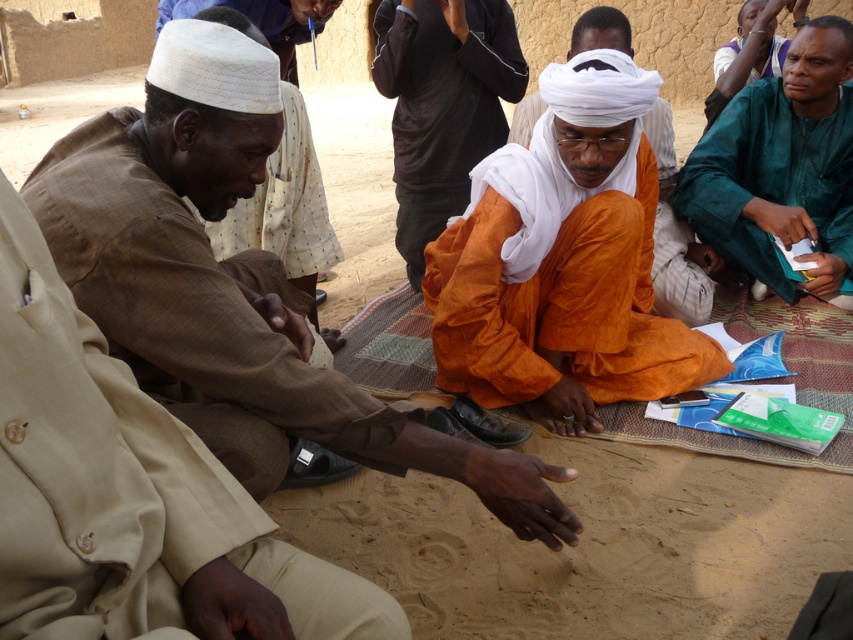
You are standing at the center of the image and want to reach the green matte shirt at right. Which direction should you move in to get there?

The green matte shirt at right is located at point 0.259 on the x axis and 0.917 on the y axis. Since you are at the center, moving towards the right and upwards will lead you to the green matte shirt at right.

You are standing at the center of the scene and want to pick up the beige cotton robe at left. Which direction should you move to reach it?

The beige cotton robe at left is located at point 0.767 on the x axis and 0.149 on the y axis. Since you are at the center, moving towards the left and slightly downward would bring you closer to the beige cotton robe at left.

You are a photographer trying to capture a closeup of the orange cloth at center and orange cotton turban at center. Which one should you focus on first if you want to ensure both are in focus, considering their positions relative to each other?

The orange cloth at center is positioned on the left side of the orange cotton turban at center, so you should focus on the orange cloth at center first to ensure both are in focus.